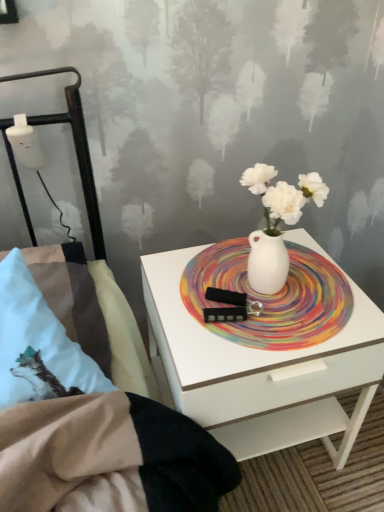
Question: Is white plastic bottle at left taller than rainbow painted platter at center?

Choices:
 (A) yes
 (B) no

Answer: (A)

Question: Considering the relative positions of white plastic bottle at left and rainbow painted platter at center in the image provided, is white plastic bottle at left behind rainbow painted platter at center?

Choices:
 (A) no
 (B) yes

Answer: (B)

Question: From the image's perspective, does white plastic bottle at left appear higher than rainbow painted platter at center?

Choices:
 (A) no
 (B) yes

Answer: (B)

Question: From a real-world perspective, is white plastic bottle at left physically above rainbow painted platter at center?

Choices:
 (A) no
 (B) yes

Answer: (B)

Question: Is white plastic bottle at left not inside rainbow painted platter at center?

Choices:
 (A) no
 (B) yes

Answer: (B)

Question: Considering the positions of white glossy nightstand at center and rainbow painted platter at center in the image, is white glossy nightstand at center wider or thinner than rainbow painted platter at center?

Choices:
 (A) wide
 (B) thin

Answer: (A)

Question: Is point (243, 392) positioned closer to the camera than point (266, 328)?

Choices:
 (A) closer
 (B) farther

Answer: (A)

Question: Is white glossy nightstand at center spatially inside rainbow painted platter at center, or outside of it?

Choices:
 (A) outside
 (B) inside

Answer: (A)

Question: In the image, is white glossy nightstand at center on the left side or the right side of rainbow painted platter at center?

Choices:
 (A) right
 (B) left

Answer: (B)

Question: Is white glossy nightstand at center taller or shorter than white plastic bottle at left?

Choices:
 (A) short
 (B) tall

Answer: (B)

Question: From the image's perspective, is white glossy nightstand at center located above or below white plastic bottle at left?

Choices:
 (A) above
 (B) below

Answer: (B)

Question: Relative to white plastic bottle at left, is white glossy nightstand at center in front or behind?

Choices:
 (A) behind
 (B) front

Answer: (B)

Question: Is white glossy nightstand at center bigger or smaller than white plastic bottle at left?

Choices:
 (A) big
 (B) small

Answer: (A)

Question: From the image's perspective, is rainbow painted platter at center positioned above or below white plastic bottle at left?

Choices:
 (A) above
 (B) below

Answer: (B)

Question: Considering their positions, is rainbow painted platter at center located in front of or behind white plastic bottle at left?

Choices:
 (A) behind
 (B) front

Answer: (B)